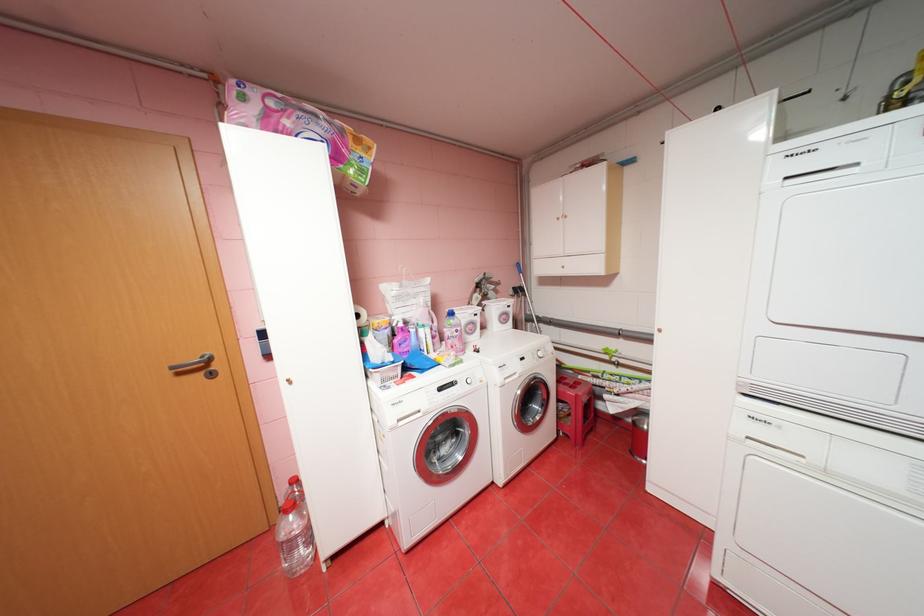
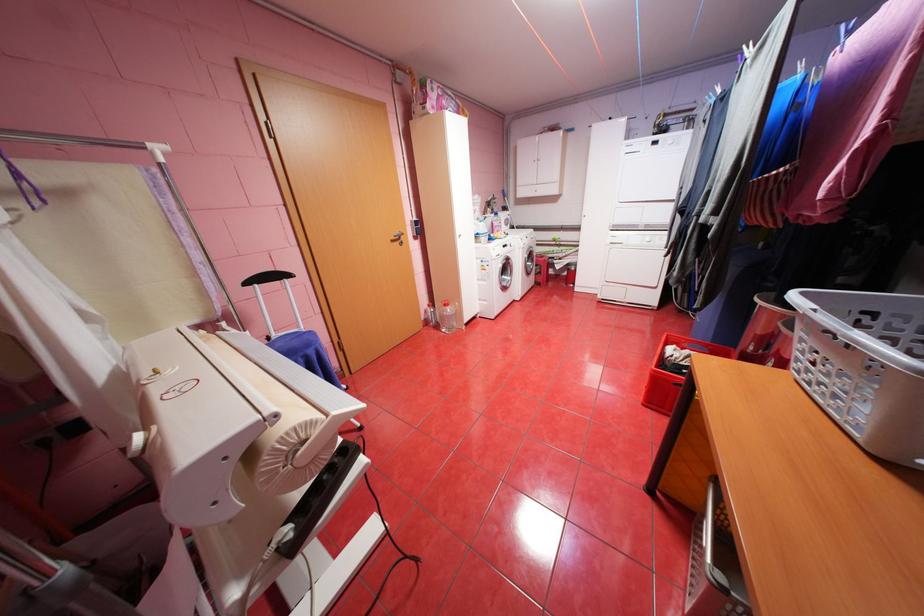
Where in the second image is the point corresponding to [188,373] from the first image?

(400, 241)